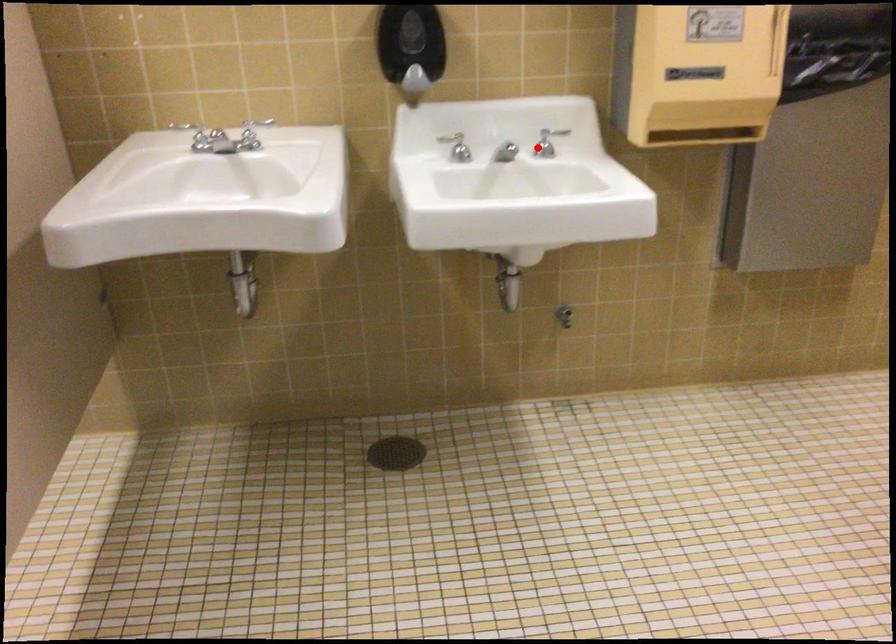
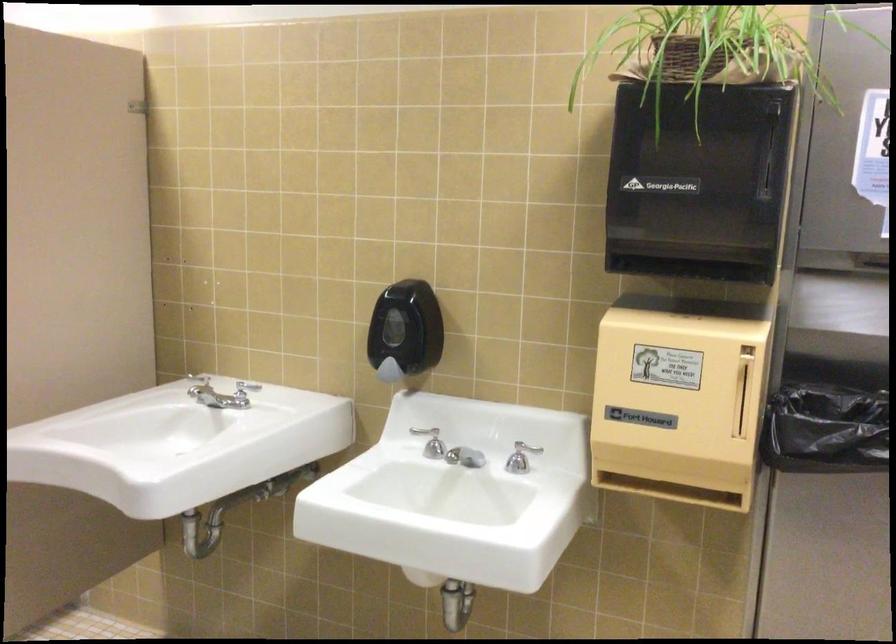
Find the pixel in the second image that matches the highlighted location in the first image.

(521, 458)